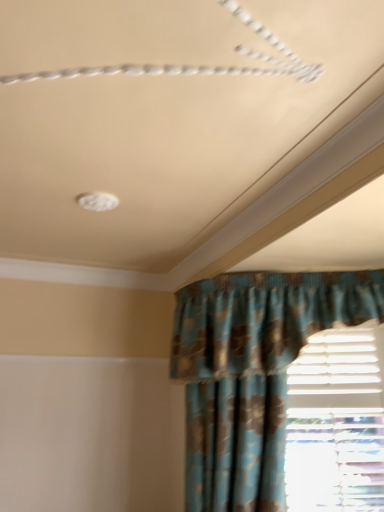
Question: In the image, is white plastic blinds at lower right positioned in front of or behind blue textured fabric curtain at lower right?

Choices:
 (A) front
 (B) behind

Answer: (B)

Question: From a real-world perspective, is white plastic blinds at lower right positioned above or below blue textured fabric curtain at lower right?

Choices:
 (A) below
 (B) above

Answer: (A)

Question: Based on their positions, is white plastic blinds at lower right located to the left or right of blue textured fabric curtain at lower right?

Choices:
 (A) right
 (B) left

Answer: (A)

Question: Is blue textured fabric curtain at lower right to the left or to the right of white plastic blinds at lower right in the image?

Choices:
 (A) right
 (B) left

Answer: (B)

Question: Looking at their shapes, would you say blue textured fabric curtain at lower right is wider or thinner than white plastic blinds at lower right?

Choices:
 (A) thin
 (B) wide

Answer: (B)

Question: From the image's perspective, relative to white plastic blinds at lower right, is blue textured fabric curtain at lower right above or below?

Choices:
 (A) above
 (B) below

Answer: (A)

Question: From a real-world perspective, is blue textured fabric curtain at lower right positioned above or below white plastic blinds at lower right?

Choices:
 (A) above
 (B) below

Answer: (A)